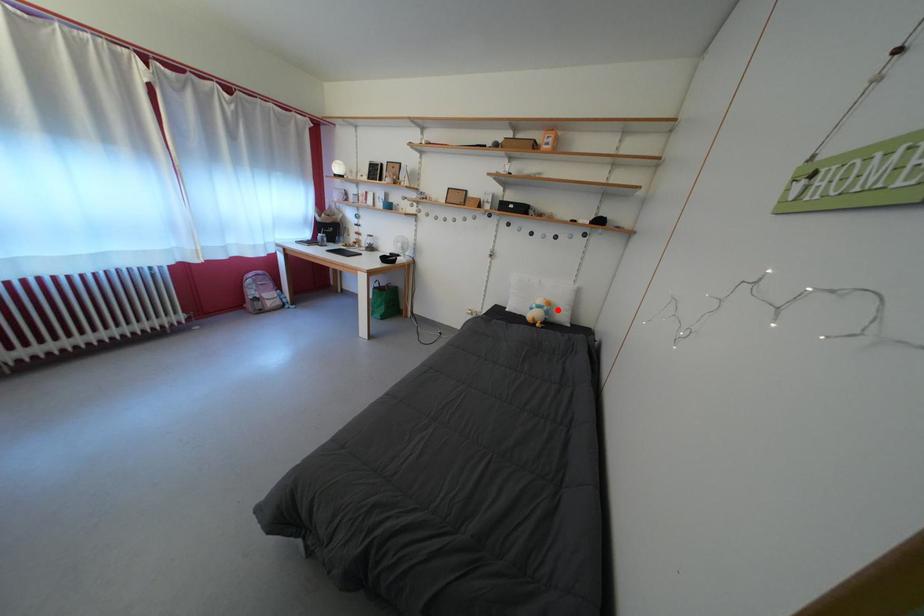
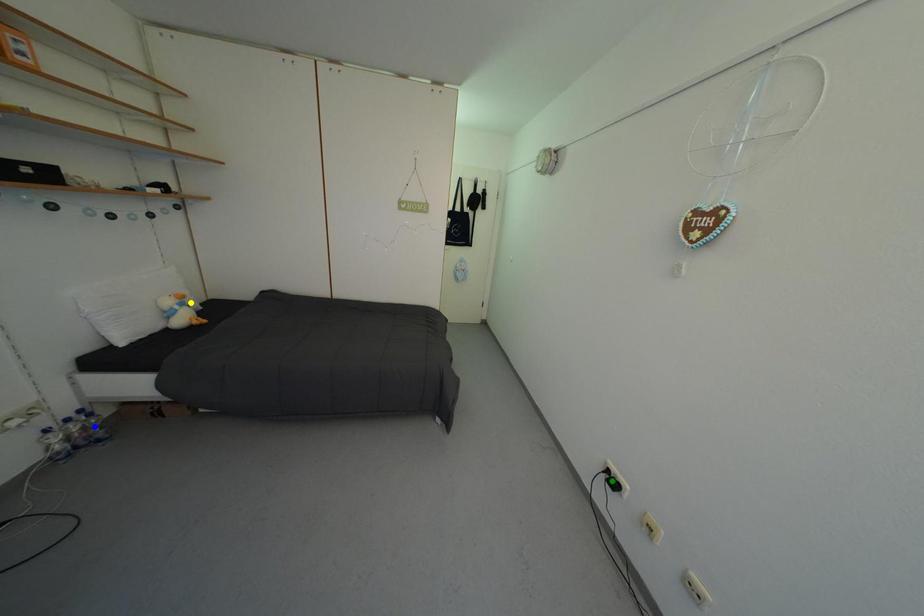
Question: I am providing you with two images of the same scene from different viewpoints. A red point is marked on the first image. You are given multiple points on the second image. Which point in image 2 is actually the same real-world point as the red point in image 1?

Choices:
 (A) green point
 (B) blue point
 (C) yellow point

Answer: (C)